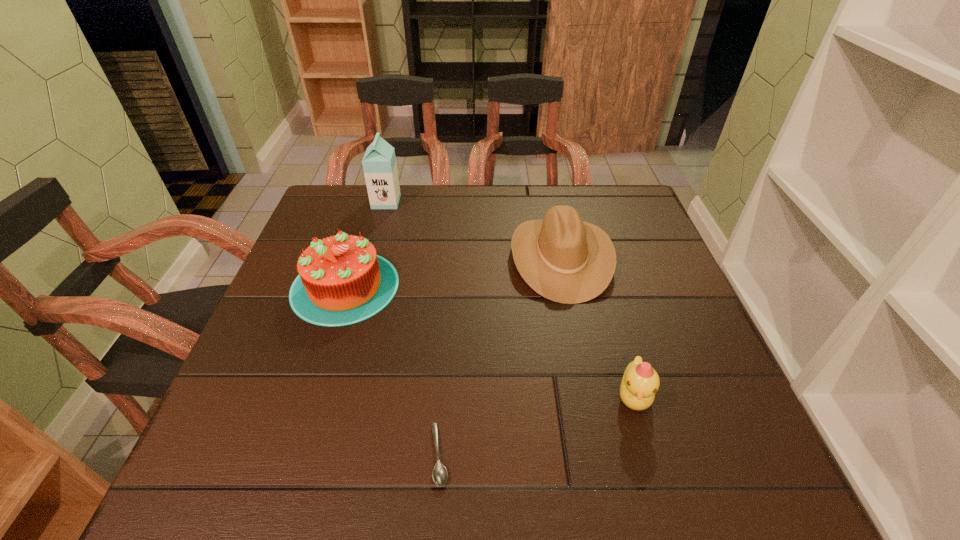
The width and height of the screenshot is (960, 540). Identify the location of object positioned at the far right corner. (564, 259).

This screenshot has height=540, width=960. In the image, there is a desktop. In order to click on vacant area at the far edge in this screenshot , I will do `click(534, 199)`.

Locate an element on the screen. This screenshot has height=540, width=960. vacant space at the near edge is located at coordinates (524, 450).

Identify the location of vacant area at the left edge. Image resolution: width=960 pixels, height=540 pixels. (291, 394).

The width and height of the screenshot is (960, 540). I want to click on free space at the right edge, so click(638, 251).

I want to click on vacant space at the far left corner, so click(352, 221).

In the image, there is a desktop. Identify the location of free region at the near left corner. (283, 449).

You are a GUI agent. You are given a task and a screenshot of the screen. Output one action in this format:
    pyautogui.click(x=<x>, y=<y>)
    Task: Click on the free spot at the far right corner of the desktop
    
    Given the screenshot: What is the action you would take?
    pyautogui.click(x=645, y=226)

Find the location of a particular element. This screenshot has height=540, width=960. blank area at the near right corner is located at coordinates (747, 453).

Identify the location of vacant point located between the milk carton and the cowboy hat. tap(473, 230).